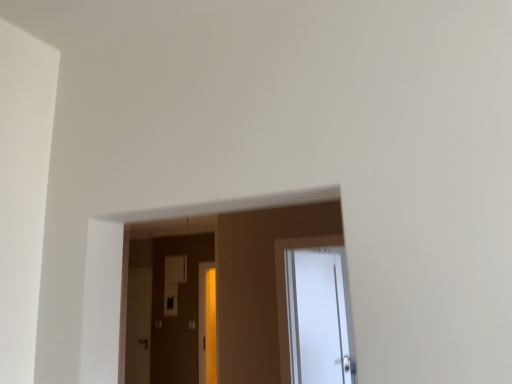
Question: From the image's perspective, relative to matte white screen door at center, is white glossy door at center above or below?

Choices:
 (A) below
 (B) above

Answer: (B)

Question: Choose the correct answer: Is white glossy door at center inside matte white screen door at center or outside it?

Choices:
 (A) outside
 (B) inside

Answer: (A)

Question: Considering the positions of white glossy door at center and matte white screen door at center in the image, is white glossy door at center wider or thinner than matte white screen door at center?

Choices:
 (A) thin
 (B) wide

Answer: (B)

Question: From a real-world perspective, relative to white glossy door at center, is matte white screen door at center vertically above or below?

Choices:
 (A) above
 (B) below

Answer: (B)

Question: Considering the relative positions of matte white screen door at center and white glossy door at center in the image provided, is matte white screen door at center to the left or to the right of white glossy door at center?

Choices:
 (A) left
 (B) right

Answer: (A)

Question: Considering the positions of matte white screen door at center and white glossy door at center in the image, is matte white screen door at center wider or thinner than white glossy door at center?

Choices:
 (A) thin
 (B) wide

Answer: (A)

Question: From the image's perspective, is matte white screen door at center located above or below white glossy door at center?

Choices:
 (A) below
 (B) above

Answer: (A)